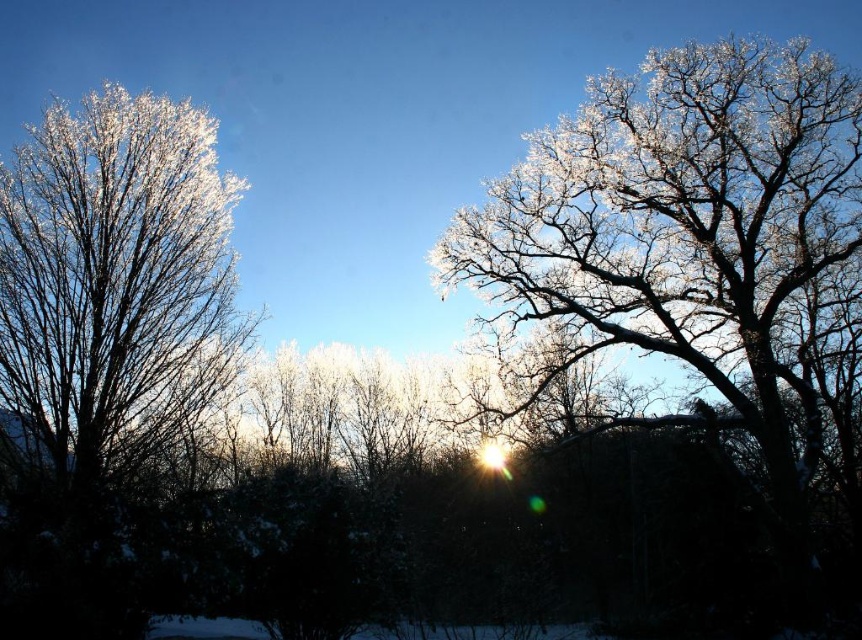
You are standing in the winter scene and want to locate the frosted white tree at upper right. According to the coordinates provided, where should you look?

You should look at point (686, 244) to find the frosted white tree at upper right.